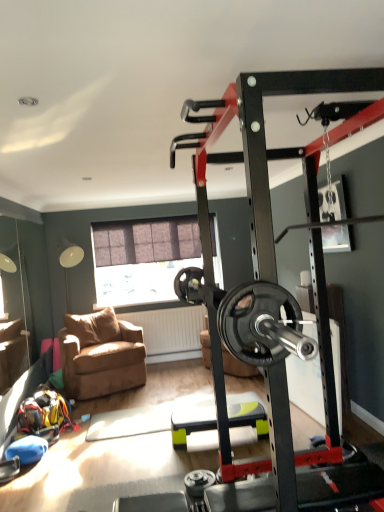
Question: Is the surface of brown fabric chair at lower left in direct contact with green plastic step platform at center?

Choices:
 (A) no
 (B) yes

Answer: (A)

Question: From the image's perspective, is brown fabric chair at lower left located above green plastic step platform at center?

Choices:
 (A) no
 (B) yes

Answer: (B)

Question: Is brown fabric chair at lower left further to camera compared to green plastic step platform at center?

Choices:
 (A) no
 (B) yes

Answer: (B)

Question: Is brown fabric chair at lower left bigger than green plastic step platform at center?

Choices:
 (A) yes
 (B) no

Answer: (A)

Question: From the image's perspective, is brown fabric chair at lower left below green plastic step platform at center?

Choices:
 (A) no
 (B) yes

Answer: (A)

Question: Would you say brown fabric chair at lower left is outside green plastic step platform at center?

Choices:
 (A) no
 (B) yes

Answer: (B)

Question: Does matte brown window at center have a greater width compared to brown fabric chair at lower left?

Choices:
 (A) no
 (B) yes

Answer: (A)

Question: Is matte brown window at center not close to brown fabric chair at lower left?

Choices:
 (A) no
 (B) yes

Answer: (B)

Question: Could you tell me if matte brown window at center is facing brown fabric chair at lower left?

Choices:
 (A) yes
 (B) no

Answer: (B)

Question: From a real-world perspective, is matte brown window at center over brown fabric chair at lower left?

Choices:
 (A) no
 (B) yes

Answer: (B)

Question: Does matte brown window at center come behind brown fabric chair at lower left?

Choices:
 (A) yes
 (B) no

Answer: (A)

Question: Is matte brown window at center oriented away from brown fabric chair at lower left?

Choices:
 (A) no
 (B) yes

Answer: (A)

Question: Is green plastic step platform at center bigger than matte brown window at center?

Choices:
 (A) no
 (B) yes

Answer: (A)